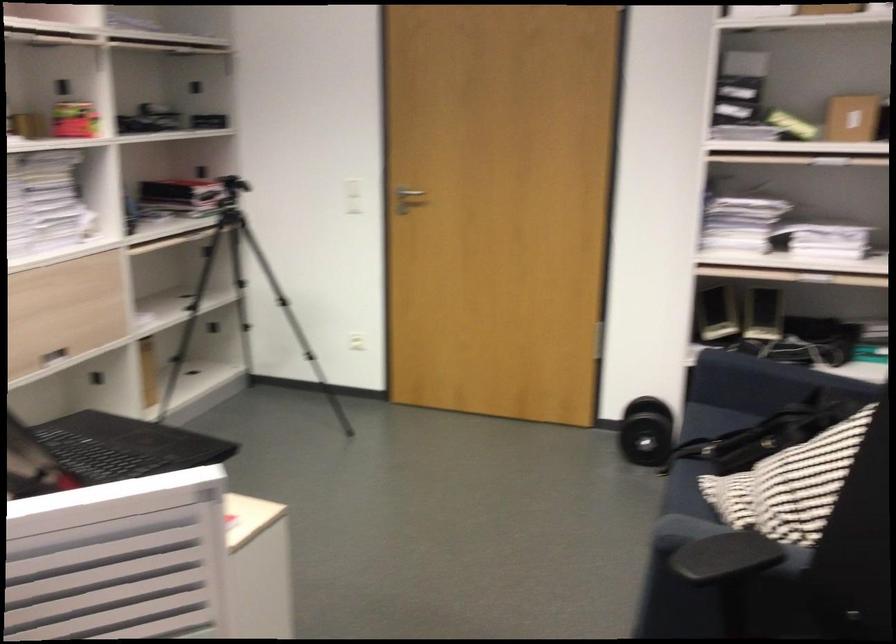
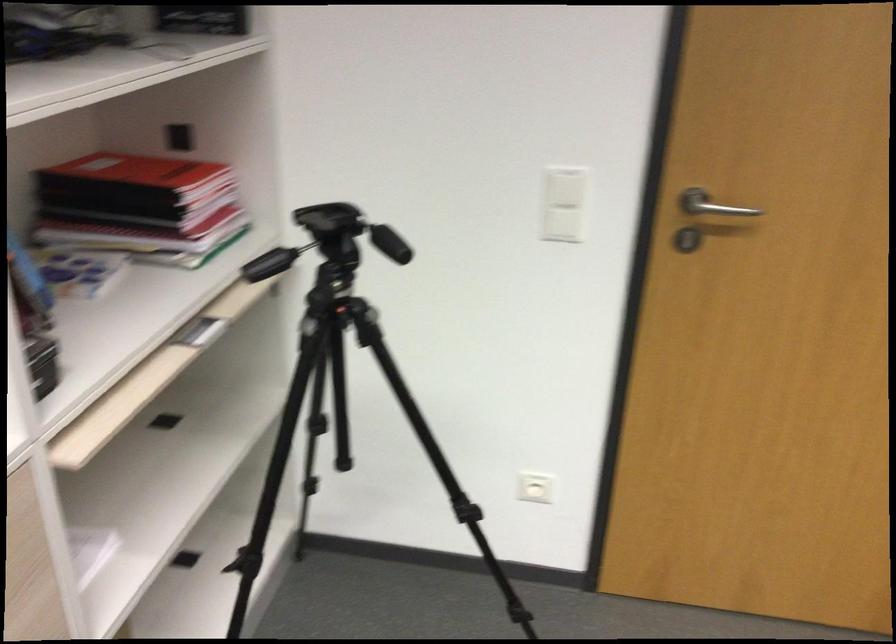
The point at (184, 182) is marked in the first image. Where is the corresponding point in the second image?

(133, 172)